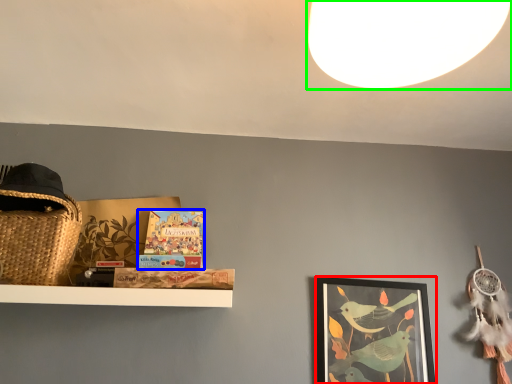
Question: Which object is positioned closest to picture frame (highlighted by a red box)? Select from book (highlighted by a blue box) and light (highlighted by a green box).

Choices:
 (A) book
 (B) light

Answer: (A)